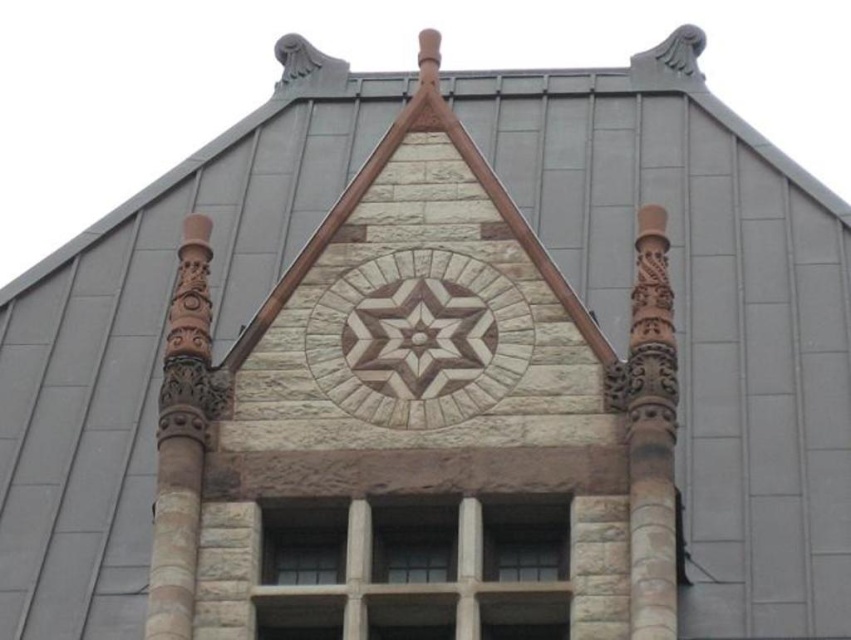
You are an architect reviewing the building facade. You need to determine the position of the brown carved wood pillar at right relative to the triangular gable. Is it positioned to the left or right of the gable?

The brown carved wood pillar at right is located at point (650,435), which places it to the right of the triangular gable.

You are an architect examining the building facade. You notice the brown stone star at center and the brown carved wood pillar at right. Which object has a greater width?

The brown stone star at center has a greater width than the brown carved wood pillar at right.